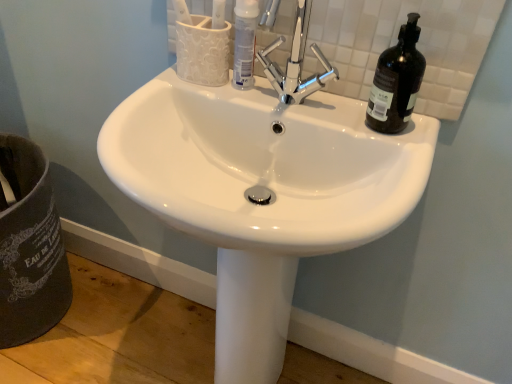
Question: Is white glossy sink at center to the left of black glass bottle at upper right from the viewer's perspective?

Choices:
 (A) no
 (B) yes

Answer: (B)

Question: Could you tell me if white glossy sink at center is turned towards black glass bottle at upper right?

Choices:
 (A) yes
 (B) no

Answer: (B)

Question: Is there a large distance between white glossy sink at center and black glass bottle at upper right?

Choices:
 (A) yes
 (B) no

Answer: (B)

Question: Does white glossy sink at center have a greater width compared to black glass bottle at upper right?

Choices:
 (A) no
 (B) yes

Answer: (B)

Question: Considering the relative sizes of white glossy sink at center and black glass bottle at upper right in the image provided, is white glossy sink at center bigger than black glass bottle at upper right?

Choices:
 (A) yes
 (B) no

Answer: (A)

Question: In the image, is black glass bottle at upper right on the left side or the right side of white glossy tube at center?

Choices:
 (A) right
 (B) left

Answer: (A)

Question: Relative to white glossy tube at center, is black glass bottle at upper right in front or behind?

Choices:
 (A) front
 (B) behind

Answer: (A)

Question: From the image's perspective, is black glass bottle at upper right above or below white glossy tube at center?

Choices:
 (A) below
 (B) above

Answer: (A)

Question: Is black glass bottle at upper right taller or shorter than white glossy tube at center?

Choices:
 (A) tall
 (B) short

Answer: (A)

Question: In terms of size, does white glossy sink at center appear bigger or smaller than black glass bottle at upper right?

Choices:
 (A) small
 (B) big

Answer: (B)

Question: Is white glossy sink at center inside the boundaries of black glass bottle at upper right, or outside?

Choices:
 (A) inside
 (B) outside

Answer: (B)

Question: Is white glossy sink at center taller or shorter than black glass bottle at upper right?

Choices:
 (A) tall
 (B) short

Answer: (A)

Question: In the image, is white glossy sink at center positioned in front of or behind black glass bottle at upper right?

Choices:
 (A) front
 (B) behind

Answer: (A)

Question: From a real-world perspective, is white glossy tube at center positioned above or below black glass bottle at upper right?

Choices:
 (A) below
 (B) above

Answer: (A)

Question: In the image, is white glossy tube at center on the left side or the right side of black glass bottle at upper right?

Choices:
 (A) right
 (B) left

Answer: (B)